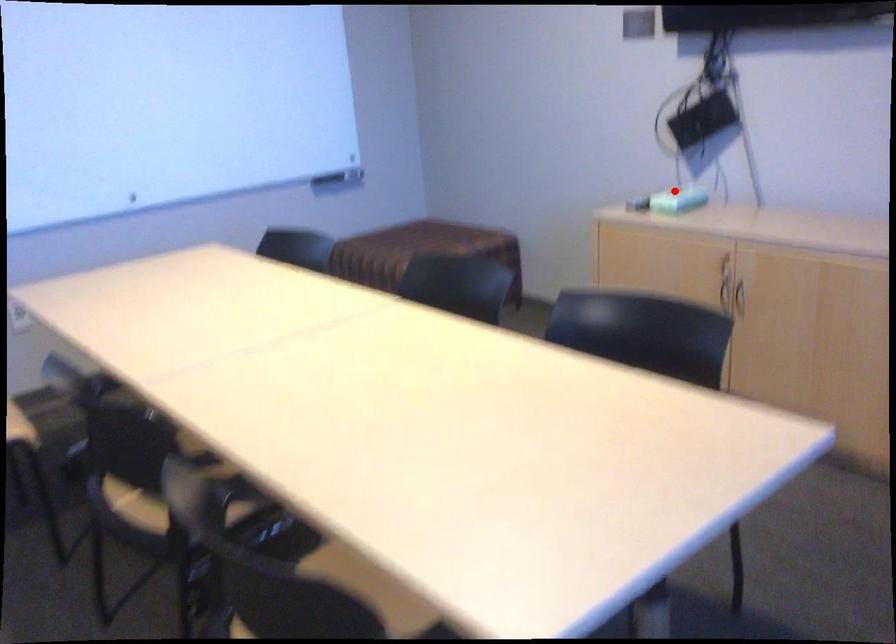
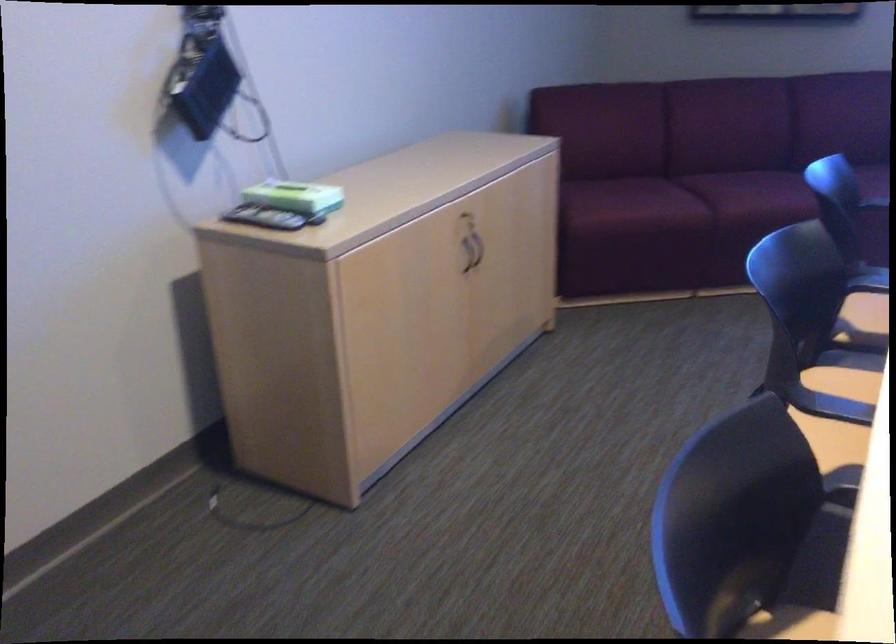
In the second image, find the point that corresponds to the highlighted location in the first image.

(287, 196)